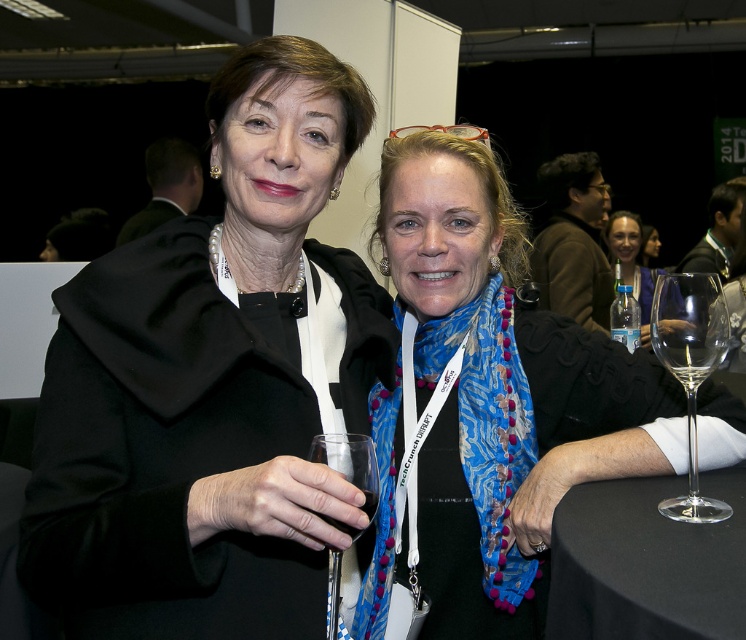
Consider the image. Which is above, clear glass wine glass at center or clear glass wine at right?

clear glass wine at right is above.

Who is lower down, clear glass wine glass at center or clear glass wine at right?

clear glass wine glass at center is below.

At what (x,y) coordinates should I click in order to perform the action: click on clear glass wine glass at center. Please return your answer as a coordinate pair (x, y). This screenshot has height=640, width=746. Looking at the image, I should click on pos(348,461).

Is point (148, 534) closer to viewer compared to point (617, 500)?

Yes, point (148, 534) is in front of point (617, 500).

Who is shorter, black matte coat at upper left or black fabric table at lower right?

Standing shorter between the two is black fabric table at lower right.

Who is more distant from viewer, (322, 636) or (724, 476)?

The point (724, 476) is more distant.

Locate an element on the screen. black matte coat at upper left is located at coordinates (213, 384).

From the picture: Between transparent glass wine glass at right and clear glass wine at right, which one is positioned higher?

clear glass wine at right is above.

How far apart are transparent glass wine glass at right and clear glass wine at right?

The distance of transparent glass wine glass at right from clear glass wine at right is 1.29 inches.

Which is behind, point (680, 348) or point (692, 342)?

Positioned behind is point (680, 348).

Where is `transparent glass wine glass at right`? The image size is (746, 640). transparent glass wine glass at right is located at coordinates (689, 365).